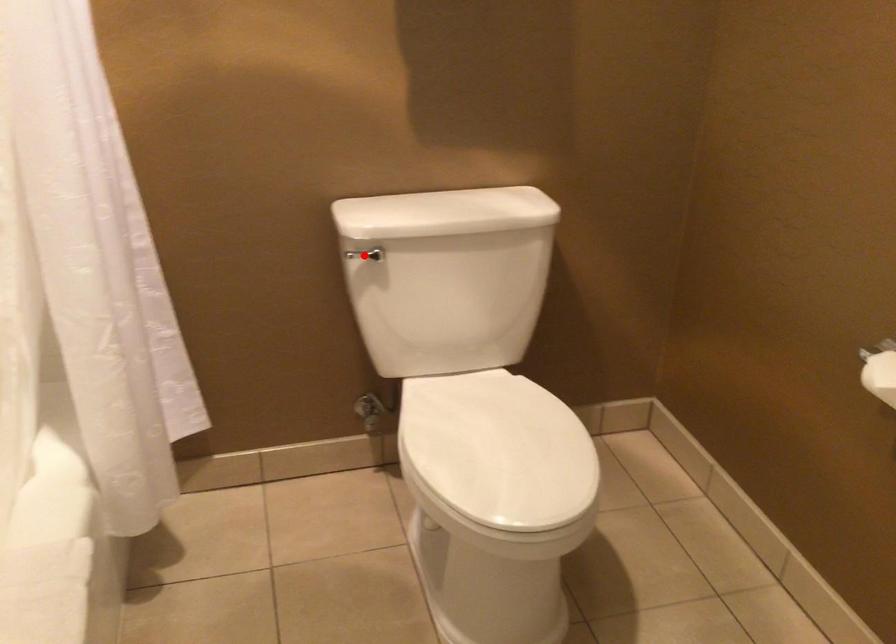
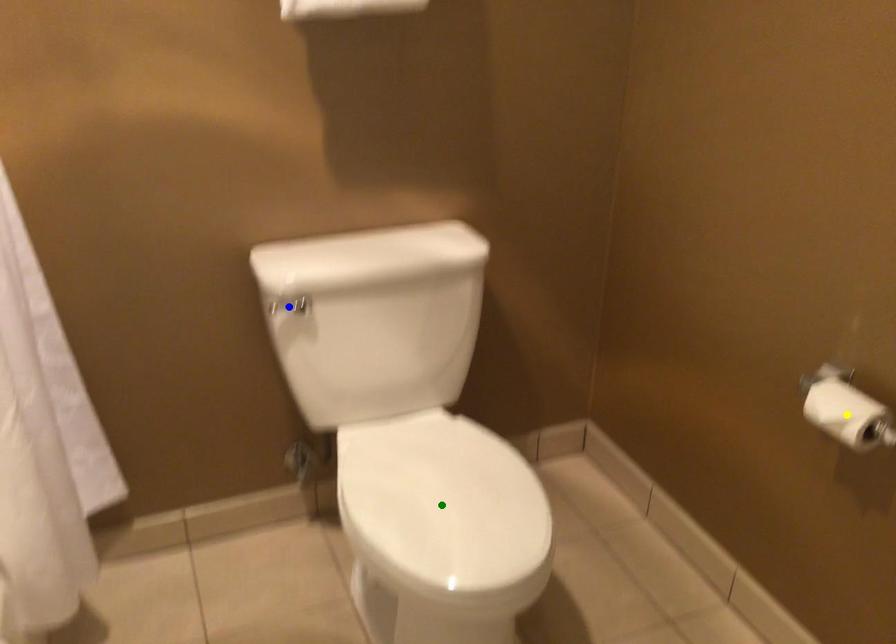
Question: I am providing you with two images of the same scene from different viewpoints. A red point is marked on the first image. You are given multiple points on the second image. Which mark in image 2 goes with the point in image 1?

Choices:
 (A) yellow point
 (B) blue point
 (C) green point

Answer: (B)